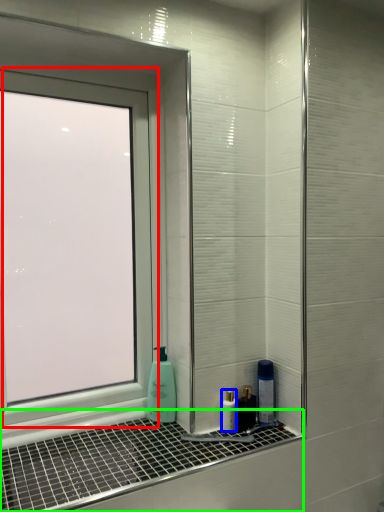
Question: Based on their relative distances, which object is nearer to window (highlighted by a red box)? Choose from mouthwash (highlighted by a blue box) and window sill (highlighted by a green box).

Choices:
 (A) mouthwash
 (B) window sill

Answer: (B)